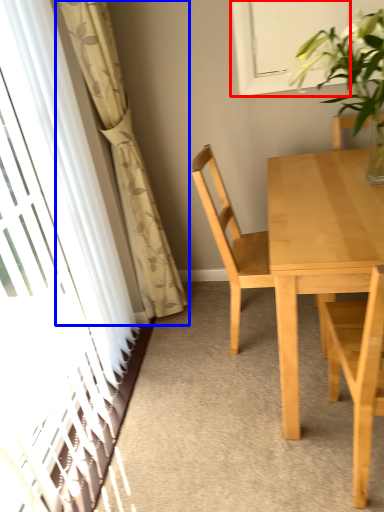
Question: Among these objects, which one is farthest to the camera, window (highlighted by a red box) or curtain (highlighted by a blue box)?

Choices:
 (A) window
 (B) curtain

Answer: (A)